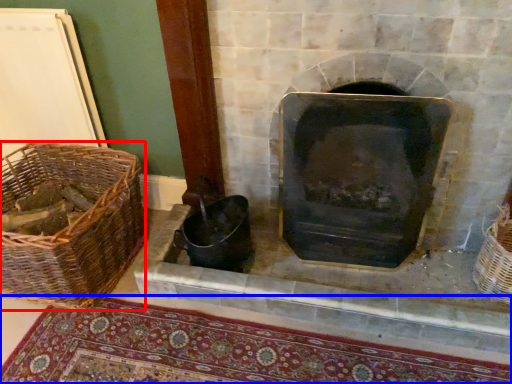
Question: Among these objects, which one is nearest to the camera, basket (highlighted by a red box) or mat (highlighted by a blue box)?

Choices:
 (A) basket
 (B) mat

Answer: (B)